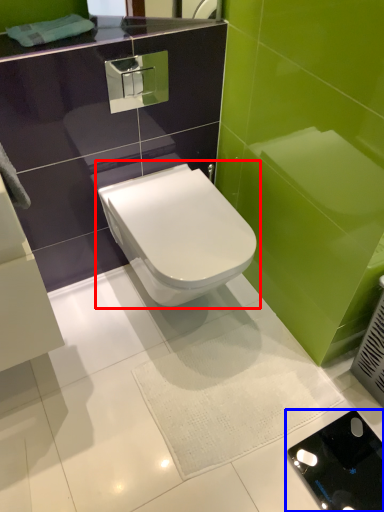
Question: Among these objects, which one is nearest to the camera, toilet (highlighted by a red box) or porcelain (highlighted by a blue box)?

Choices:
 (A) toilet
 (B) porcelain

Answer: (A)